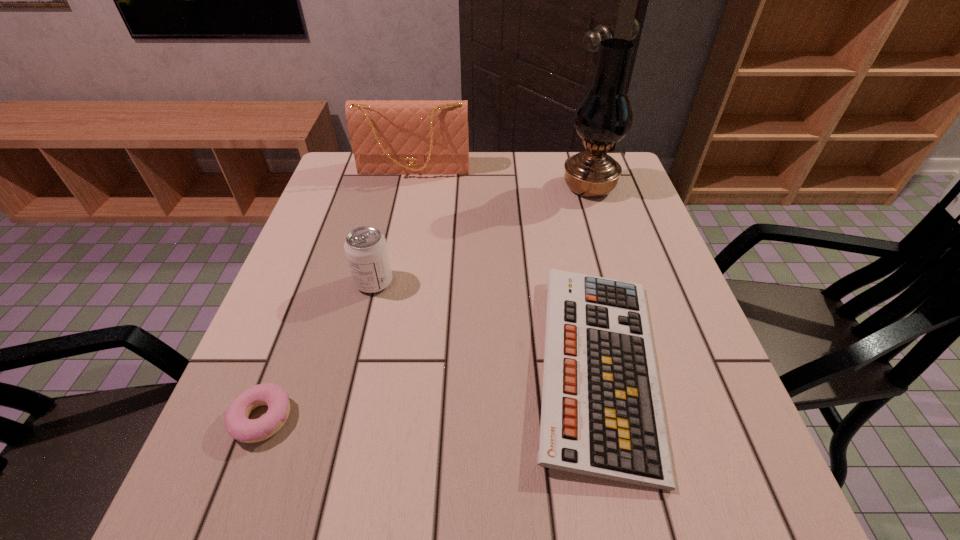
This screenshot has height=540, width=960. I want to click on free space that satisfies the following two spatial constraints: 1. on the front-facing side of the computer keyboard; 2. on the right side of the handbag, so click(x=375, y=366).

Identify the location of free space that satisfies the following two spatial constraints: 1. on the front-facing side of the handbag; 2. on the right side of the computer keyboard. Image resolution: width=960 pixels, height=540 pixels. (375, 366).